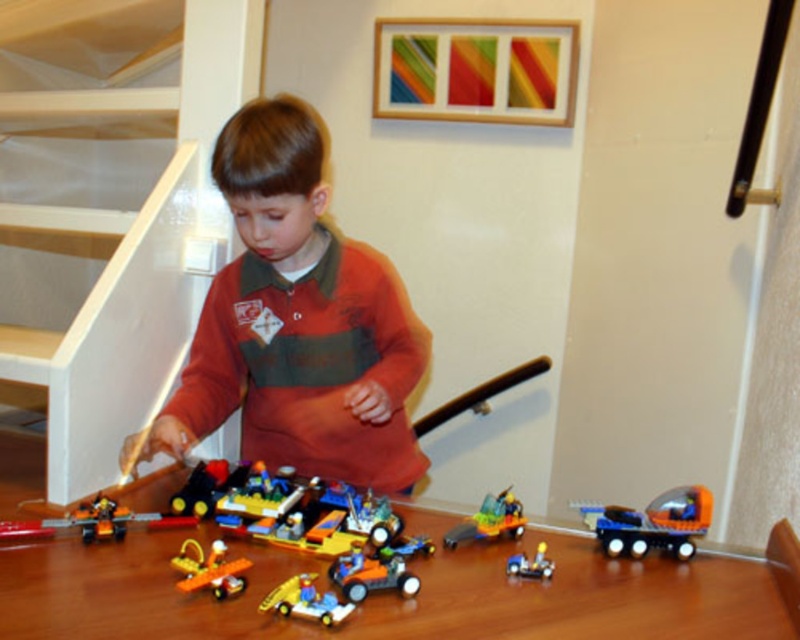
You are a toy organizer who needs to place a new toy truck between the translucent orange airplane at lower left and the translucent orange car at center. The truck requires 15 inches of space. Can it fit in the available space between them?

The distance between the translucent orange airplane at lower left and the translucent orange car at center is 16.47 inches. Since the truck requires 15 inches of space, it can fit in the available space between them as there is enough room.

You are a child playing with the translucent orange airplane at lower left and the translucent orange car at center. You want to move the airplane to the back so you can see the car better. Which direction should you move the airplane?

The translucent orange airplane at lower left is currently in front of the translucent orange car at center. To move it to the back, you should move it towards the back of the car so it is positioned behind it.

In the scene shown: You are a toy organizer trying to arrange the orange matte car at center and the translucent yellow car at center on a shelf. The shelf has a space that can only accommodate the narrower of the two cars. Which car should you choose?

The translucent yellow car at center is narrower than the orange matte car at center, so you should choose the translucent yellow car at center for the shelf space.